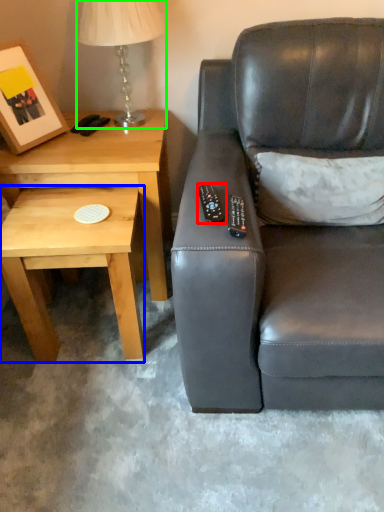
Question: Based on their relative distances, which object is nearer to remote (highlighted by a red box)? Choose from coffee table (highlighted by a blue box) and table lamp (highlighted by a green box).

Choices:
 (A) coffee table
 (B) table lamp

Answer: (A)